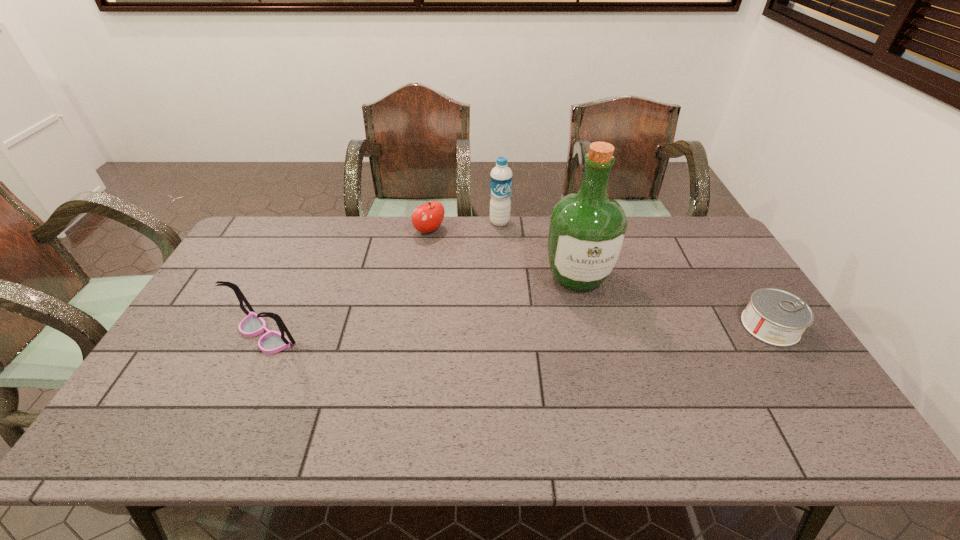
Find the location of a particular element. This screenshot has width=960, height=540. free space located on the right of the leftmost object is located at coordinates (361, 334).

The width and height of the screenshot is (960, 540). In order to click on free point located 0.340m on the back of the shortest object in this screenshot , I will do `click(712, 237)`.

Identify the location of vacant space located on the label of the second tallest object. (509, 248).

Locate an element on the screen. The height and width of the screenshot is (540, 960). free space located on the label of the second tallest object is located at coordinates coord(512,258).

This screenshot has width=960, height=540. Identify the location of vacant space located on the label of the second tallest object. (517, 275).

Find the location of a particular element. blank area located 0.090m on the stem of the apple is located at coordinates (451, 252).

Find the location of a particular element. The height and width of the screenshot is (540, 960). vacant region located on the stem of the apple is located at coordinates (454, 255).

Find the location of a particular element. vacant space located 0.320m on the stem of the apple is located at coordinates (491, 291).

The width and height of the screenshot is (960, 540). In order to click on vacant space located 0.100m on the front-facing side of the tallest object in this screenshot , I will do `click(592, 326)`.

Locate an element on the screen. free location located on the front-facing side of the tallest object is located at coordinates 599,348.